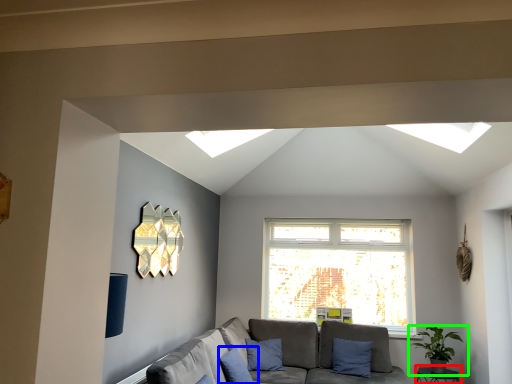
Question: Considering the real-world distances, which object is farthest from table (highlighted by a red box)? pillow (highlighted by a blue box) or houseplant (highlighted by a green box)?

Choices:
 (A) pillow
 (B) houseplant

Answer: (A)